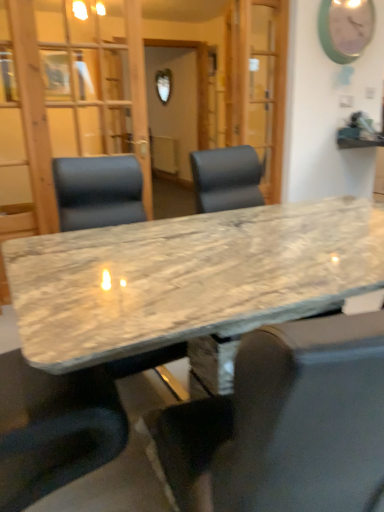
The height and width of the screenshot is (512, 384). What do you see at coordinates (66, 100) in the screenshot?
I see `transparent glass door at center` at bounding box center [66, 100].

Image resolution: width=384 pixels, height=512 pixels. I want to click on marble table at center, so click(189, 278).

Describe the element at coordinates (189, 278) in the screenshot. I see `marble table at center` at that location.

This screenshot has height=512, width=384. I want to click on leather-like black chair at center, acting as the second chair starting from the right, so click(98, 191).

Image resolution: width=384 pixels, height=512 pixels. I want to click on marble table at center, the first chair viewed from the front, so click(285, 424).

Which is more to the right, leather-like black chair at center, acting as the second chair starting from the right, or marble table at center?

Positioned to the right is marble table at center.

What's the angular difference between leather-like black chair at center, which is counted as the first chair, starting from the back, and marble table at center's facing directions?

There is a 88.4-degree angle between the facing directions of leather-like black chair at center, which is counted as the first chair, starting from the back, and marble table at center.

Does leather-like black chair at center, arranged as the second chair when viewed from the front, lie behind marble table at center?

Yes, the depth of leather-like black chair at center, arranged as the second chair when viewed from the front, is greater than that of marble table at center.

Considering the relative sizes of leather-like black chair at center, the 1th chair positioned from the left, and marble table at center in the image provided, is leather-like black chair at center, the 1th chair positioned from the left, wider than marble table at center?

Incorrect, the width of leather-like black chair at center, the 1th chair positioned from the left, does not surpass that of marble table at center.

The height and width of the screenshot is (512, 384). I want to click on the 1st chair positioned below the transparent glass door at center (from the image's perspective), so click(98, 191).

From a real-world perspective, which is physically above, transparent glass door at center or leather-like black chair at center, acting as the second chair starting from the right?

In real-world perspective, transparent glass door at center is above.

Is transparent glass door at center touching leather-like black chair at center, arranged as the second chair when viewed from the front?

There is a gap between transparent glass door at center and leather-like black chair at center, arranged as the second chair when viewed from the front.

From the image's perspective, would you say matte green clock at upper right is shown under marble table at center, which appears as the 1th chair when viewed from the right?

No, from the image's perspective, matte green clock at upper right is not beneath marble table at center, which appears as the 1th chair when viewed from the right.

From a real-world perspective, which object stands above the other?

matte green clock at upper right, from a real-world perspective.

Is matte green clock at upper right in contact with marble table at center, the first chair viewed from the front?

No, matte green clock at upper right is not with marble table at center, the first chair viewed from the front.

Find the location of a particular element. The image size is (384, 512). clock that appears above the marble table at center, which appears as the 1th chair when viewed from the right (from a real-world perspective) is located at coordinates (345, 28).

From a real-world perspective, relative to transparent glass door at center, is matte green clock at upper right vertically above or below?

matte green clock at upper right is above transparent glass door at center.

Based on the photo, which is farther, (334, 16) or (22, 32)?

The point (334, 16) is farther.

Does matte green clock at upper right have a lesser height compared to transparent glass door at center?

Yes.

You are a GUI agent. You are given a task and a screenshot of the screen. Output one action in this format:
    pyautogui.click(x=<x>, y=<y>)
    Task: Click on the glass door on the left of the matte green clock at upper right
    
    Given the screenshot: What is the action you would take?
    pyautogui.click(x=66, y=100)

Does point (273, 507) appear closer or farther from the camera than point (338, 4)?

Point (273, 507).

From the image's perspective, is marble table at center, the second chair viewed from the back, positioned above or below matte green clock at upper right?

marble table at center, the second chair viewed from the back, is below matte green clock at upper right.

Considering the relative sizes of marble table at center, the second chair viewed from the back, and matte green clock at upper right in the image provided, is marble table at center, the second chair viewed from the back, smaller than matte green clock at upper right?

Actually, marble table at center, the second chair viewed from the back, might be larger than matte green clock at upper right.

Which object is positioned more to the right, marble table at center, which ranks as the second chair in left-to-right order, or matte green clock at upper right?

From the viewer's perspective, matte green clock at upper right appears more on the right side.

From a real-world perspective, is transparent glass door at center positioned above or below marble table at center, which appears as the 1th chair when viewed from the right?

From a real-world perspective, transparent glass door at center is physically above marble table at center, which appears as the 1th chair when viewed from the right.

How many degrees apart are the facing directions of transparent glass door at center and marble table at center, which appears as the 1th chair when viewed from the right?

The angle between the facing direction of transparent glass door at center and the facing direction of marble table at center, which appears as the 1th chair when viewed from the right, is 167 degrees.

Could marble table at center, the second chair viewed from the back, be considered to be inside transparent glass door at center?

No, marble table at center, the second chair viewed from the back, is not surrounded by transparent glass door at center.

From the image's perspective, relative to marble table at center, the second chair viewed from the back, is transparent glass door at center above or below?

transparent glass door at center is situated higher than marble table at center, the second chair viewed from the back, in the image.

Based on the photo, which object is wider, leather-like black chair at center, the 1th chair positioned from the left, or transparent glass door at center?

leather-like black chair at center, the 1th chair positioned from the left, is wider.

How distant is leather-like black chair at center, the 1th chair positioned from the left, from transparent glass door at center?

The distance of leather-like black chair at center, the 1th chair positioned from the left, from transparent glass door at center is 1.21 meters.

Considering the positions of points (59, 185) and (31, 124), is point (59, 185) farther from camera compared to point (31, 124)?

No, it is in front of (31, 124).

From the image's perspective, does leather-like black chair at center, acting as the second chair starting from the right, appear lower than transparent glass door at center?

Yes, from the image's perspective, leather-like black chair at center, acting as the second chair starting from the right, is beneath transparent glass door at center.

Where is `chair above the marble table at center (from the image's perspective)`? The image size is (384, 512). chair above the marble table at center (from the image's perspective) is located at coordinates (98, 191).

From the image's perspective, which chair is the 1st one below the transparent glass door at center? Please provide its 2D coordinates.

[(98, 191)]

Considering their positions, is leather-like black chair at center, the 1th chair positioned from the left, positioned further to transparent glass door at center than marble table at center, the second chair viewed from the back?

The object further to transparent glass door at center is marble table at center, the second chair viewed from the back.

Estimate the real-world distances between objects in this image. Which object is further from marble table at center, which appears as the 1th chair when viewed from the right, transparent glass door at center or matte green clock at upper right?

matte green clock at upper right is positioned further to the anchor marble table at center, which appears as the 1th chair when viewed from the right.

Which object lies further to the anchor point marble table at center, which appears as the 1th chair when viewed from the right, matte green clock at upper right or marble table at center?

matte green clock at upper right is further to marble table at center, which appears as the 1th chair when viewed from the right.

Based on their spatial positions, is marble table at center or leather-like black chair at center, the 1th chair positioned from the left, closer to transparent glass door at center?

leather-like black chair at center, the 1th chair positioned from the left, is closer to transparent glass door at center.

Which object lies nearer to the anchor point marble table at center, leather-like black chair at center, arranged as the second chair when viewed from the front, or matte green clock at upper right?

leather-like black chair at center, arranged as the second chair when viewed from the front, lies closer to marble table at center than the other object.

When comparing their distances from leather-like black chair at center, the 1th chair positioned from the left, does marble table at center, the second chair viewed from the back, or marble table at center seem closer?

marble table at center is positioned closer to the anchor leather-like black chair at center, the 1th chair positioned from the left.

Estimate the real-world distances between objects in this image. Which object is further from matte green clock at upper right, transparent glass door at center or leather-like black chair at center, acting as the second chair starting from the right?

Among the two, leather-like black chair at center, acting as the second chair starting from the right, is located further to matte green clock at upper right.

Considering their positions, is marble table at center positioned closer to transparent glass door at center than matte green clock at upper right?

marble table at center is positioned closer to the anchor transparent glass door at center.

Find the location of `table positioned between marble table at center, which ranks as the second chair in left-to-right order, and leather-like black chair at center, which is counted as the first chair, starting from the back, from near to far`. table positioned between marble table at center, which ranks as the second chair in left-to-right order, and leather-like black chair at center, which is counted as the first chair, starting from the back, from near to far is located at coordinates (189, 278).

Where is `chair positioned between marble table at center and matte green clock at upper right from near to far`? The image size is (384, 512). chair positioned between marble table at center and matte green clock at upper right from near to far is located at coordinates (98, 191).

At what (x,y) coordinates should I click in order to perform the action: click on glass door between marble table at center and matte green clock at upper right along the z-axis. Please return your answer as a coordinate pair (x, y). Looking at the image, I should click on point(66,100).

I want to click on glass door between matte green clock at upper right and leather-like black chair at center, acting as the second chair starting from the right, in the vertical direction, so click(66, 100).